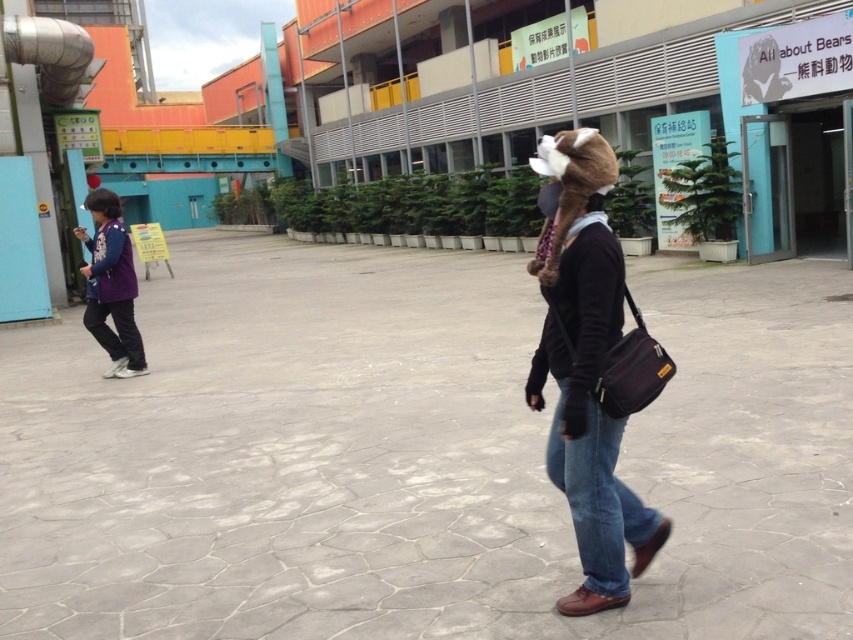
Question: Does denim jeans at lower right lie behind purple fabric jacket at left?

Choices:
 (A) no
 (B) yes

Answer: (A)

Question: Which of these objects is positioned farthest from the purple fabric jacket at left?

Choices:
 (A) denim jeans at lower right
 (B) brown fur hat at right

Answer: (A)

Question: Where is brown fur hat at right located in relation to purple fabric jacket at left in the image?

Choices:
 (A) above
 (B) below

Answer: (B)

Question: In this image, where is denim jeans at lower right located relative to purple fabric jacket at left?

Choices:
 (A) below
 (B) above

Answer: (A)

Question: Which of these objects is positioned closest to the denim jeans at lower right?

Choices:
 (A) purple fabric jacket at left
 (B) brown fur hat at right

Answer: (B)

Question: Which point is farther to the camera?

Choices:
 (A) [582, 328]
 (B) [91, 294]

Answer: (B)